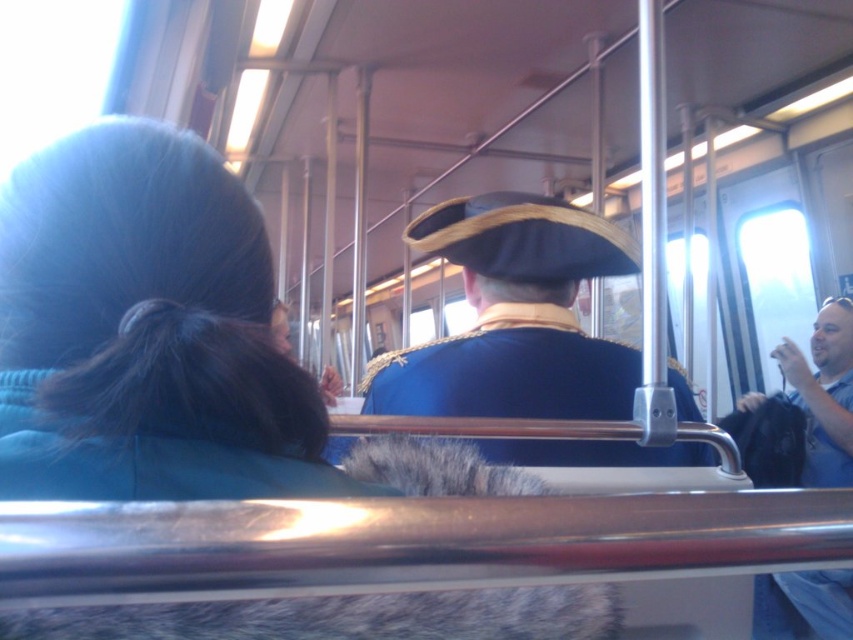
Question: Can you confirm if blue velvet coat at center is thinner than blue cotton shirt at right?

Choices:
 (A) yes
 (B) no

Answer: (B)

Question: Is blue velvet coat at center in front of blue cotton shirt at right?

Choices:
 (A) no
 (B) yes

Answer: (B)

Question: Can you confirm if blue velvet coat at center is positioned to the right of blue cotton shirt at right?

Choices:
 (A) no
 (B) yes

Answer: (A)

Question: Which point is farther to the camera?

Choices:
 (A) (451, 237)
 (B) (844, 369)

Answer: (B)